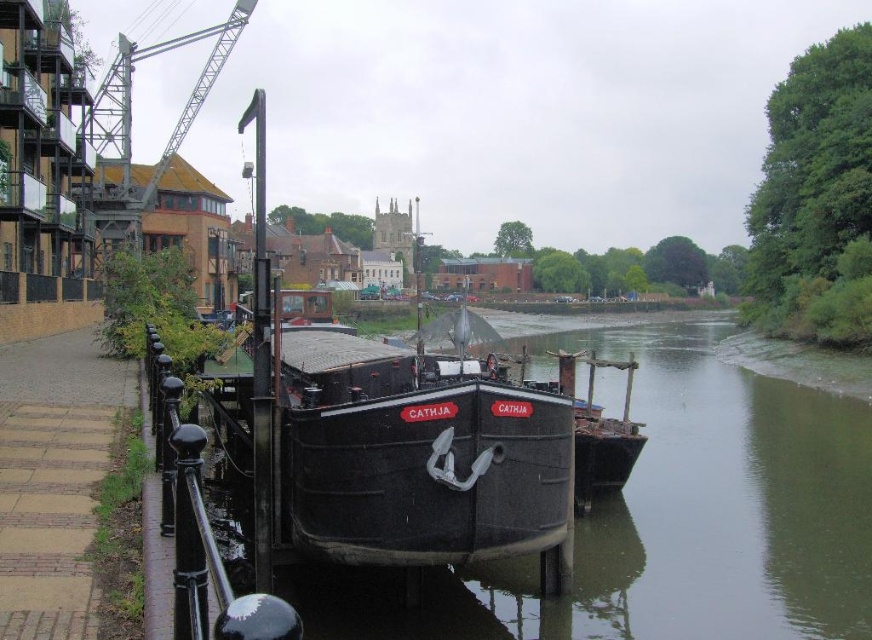
Looking at this image, you are a photographer standing on the walkway next to the black matte boat at center. You want to take a photo of the metallic gray crane at upper left. Which direction should you move to get the crane in your frame?

The black matte boat at center is below the metallic gray crane at upper left, so you should move to the left side of the black matte boat at center to get a clear view of the metallic gray crane at upper left.

You are standing on the walkway next to the black canal boat named CATHJA. There is a point at coordinate (198, 524). What object is located at that point?

The black metal railing is located at point (198, 524).